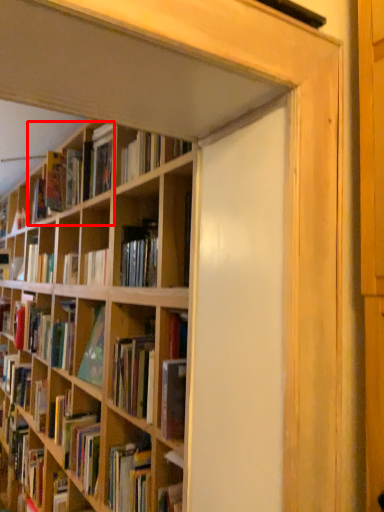
Question: Considering the relative positions of book (annotated by the red box) and book in the image provided, where is book (annotated by the red box) located with respect to the staircase?

Choices:
 (A) right
 (B) left

Answer: (A)